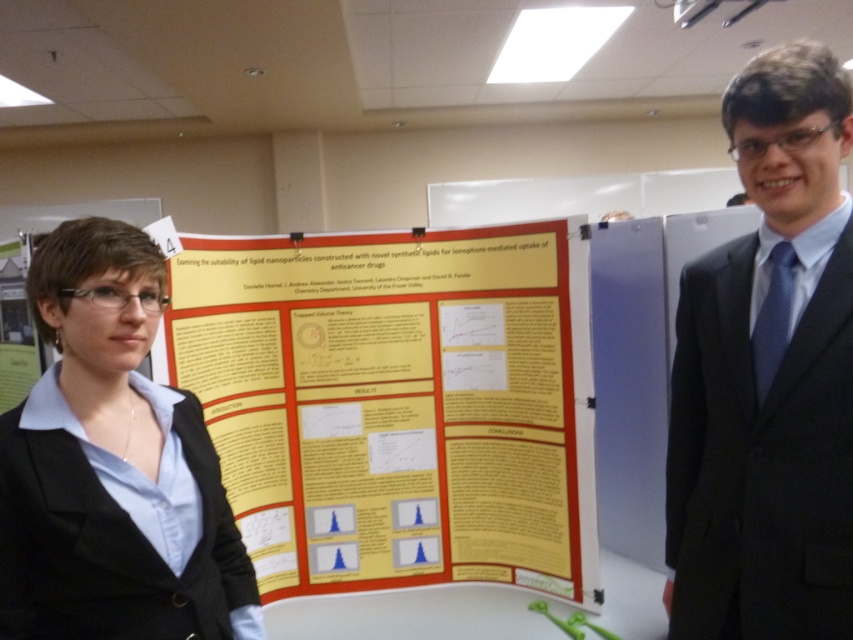
You are attending a conference and want to approach the yellow paper poster at center to ask questions. However, there is a person in a black suit at right blocking your path. Based on their positions, which direction should you walk to reach the poster without going around the person?

The yellow paper poster at center is to the left of the black suit at right, so you should walk to the left to reach the poster without going around the person in the black suit at right.

You are an attendee at the conference and want to ask the presenter about the poster. Where should you approach from to ensure you are facing both the yellow paper poster at center and the black matte blazer at center?

You should approach from the left side of the yellow paper poster at center and black matte blazer at center since the poster is on the right side of the blazer, so positioning yourself to the left would allow you to face both objects.